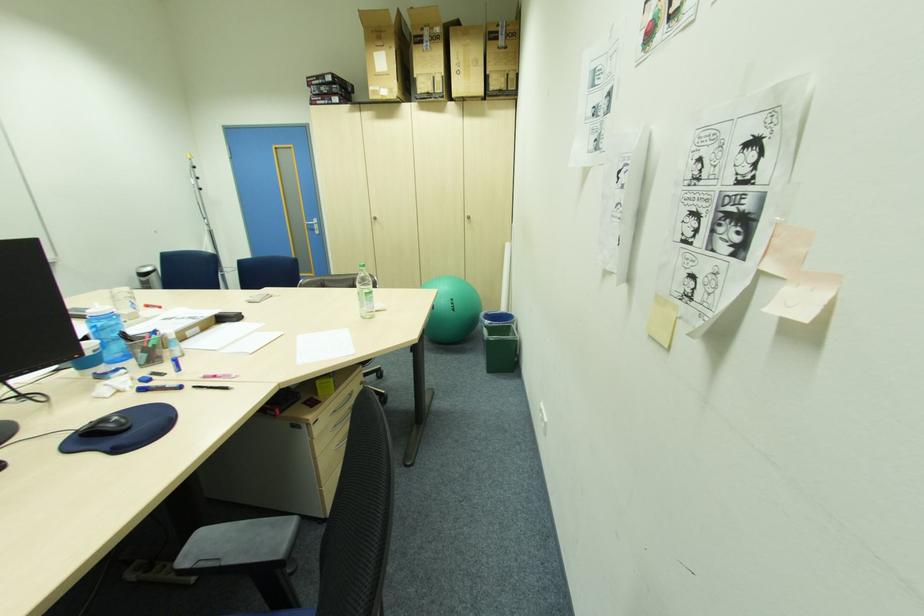
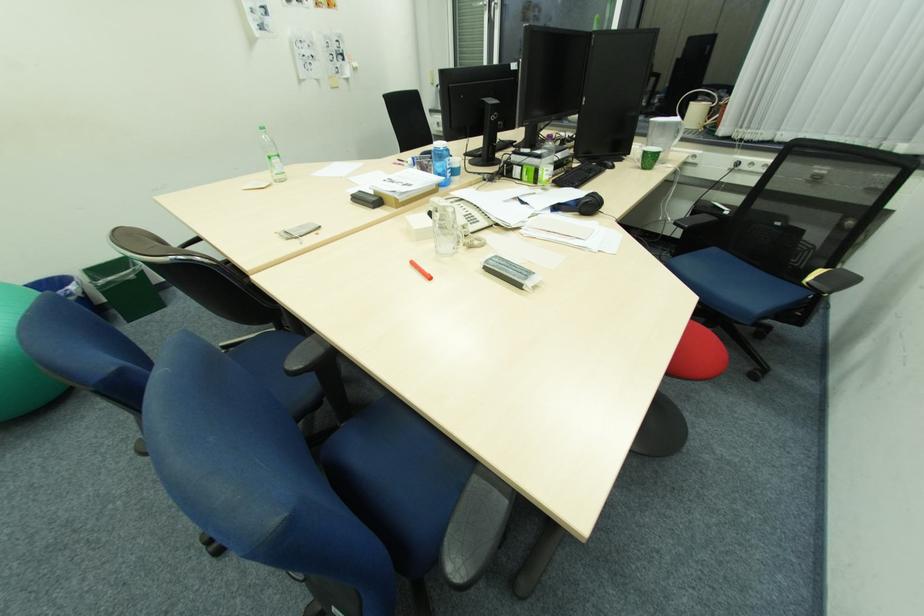
The point at (493, 321) is marked in the first image. Where is the corresponding point in the second image?

(73, 286)